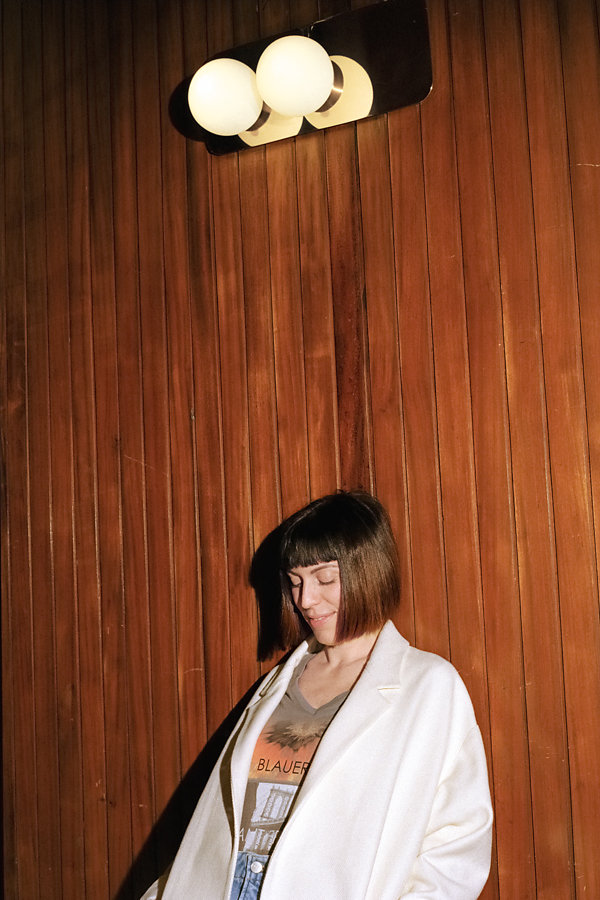
Locate an element on the screen. wooden wall panel is located at coordinates (94, 328), (440, 297).